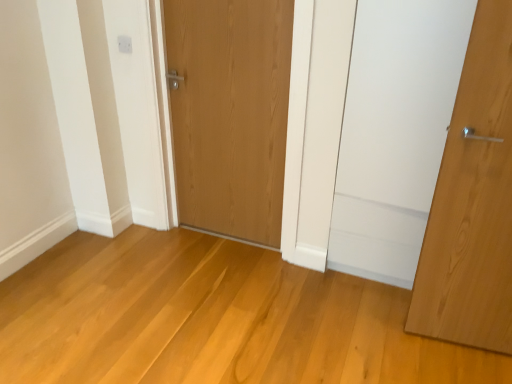
Where is `blank area beneath wooden door at center, which is counted as the first door, starting from the back (from a real-world perspective)`? The width and height of the screenshot is (512, 384). blank area beneath wooden door at center, which is counted as the first door, starting from the back (from a real-world perspective) is located at coordinates [x=227, y=233].